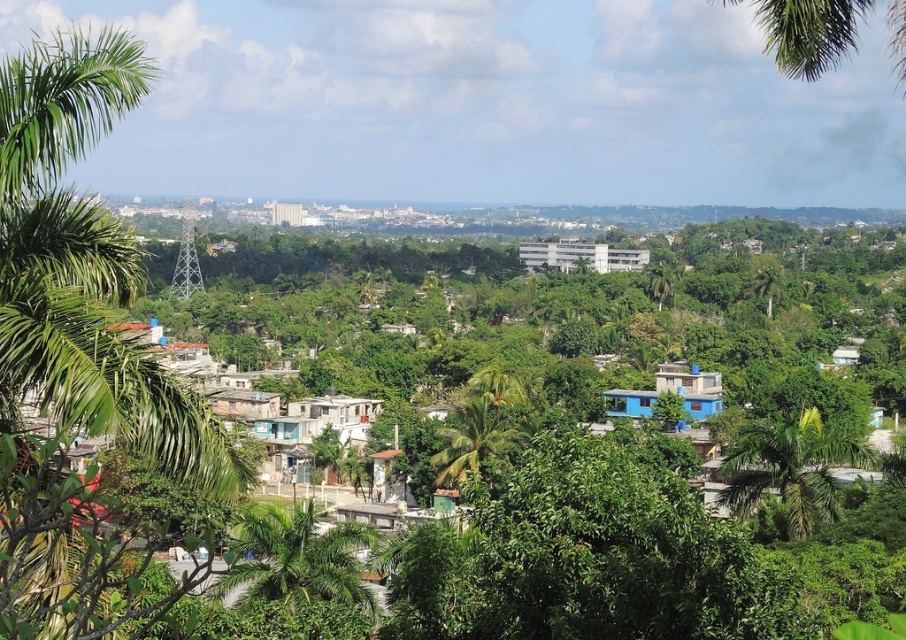
Is point (326, 545) positioned behind point (808, 492)?

No, (326, 545) is closer to viewer.

Can you confirm if green leafy palm tree at lower center is positioned to the left of green leafy palm tree at lower right?

Correct, you'll find green leafy palm tree at lower center to the left of green leafy palm tree at lower right.

Does point (326, 593) come behind point (792, 472)?

No, it is not.

This screenshot has height=640, width=906. Find the location of `green leafy palm tree at lower center`. green leafy palm tree at lower center is located at coordinates (296, 561).

Looking at this image, does green leafy palm tree at left appear under green leafy palm tree at center?

Actually, green leafy palm tree at left is above green leafy palm tree at center.

Which is behind, point (56, 365) or point (478, 417)?

Point (478, 417)

Is point (32, 180) closer to camera compared to point (496, 426)?

Yes, it is.

This screenshot has width=906, height=640. Find the location of `green leafy palm tree at left`. green leafy palm tree at left is located at coordinates [x=76, y=348].

Measure the distance between point (24, 148) and camera.

Point (24, 148) and camera are 30.26 meters apart from each other.

Between green leafy palm tree at left and green leafy palm tree at lower center, which one has more height?

green leafy palm tree at left

Does point (23, 572) come in front of point (329, 566)?

Yes, it is.

Identify the location of green leafy palm tree at left. (76, 348).